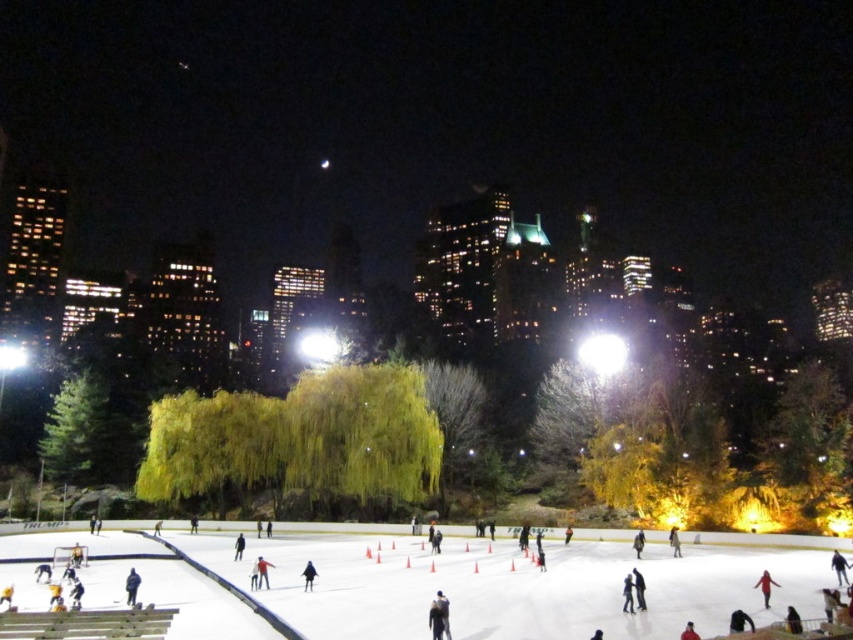
Question: Can you confirm if light blue fabric jacket at center is wider than dark brown leather jacket at center?

Choices:
 (A) no
 (B) yes

Answer: (A)

Question: Can you confirm if red fabric coat at center is positioned below blue fabric jacket at center?

Choices:
 (A) yes
 (B) no

Answer: (B)

Question: Does white fabric jacket at center have a lesser width compared to light brown leather jacket at center?

Choices:
 (A) no
 (B) yes

Answer: (B)

Question: Which object is the closest to the red fabric coat at center?

Choices:
 (A) light blue fabric jacket at center
 (B) white fabric jacket at center
 (C) dark blue fabric at center

Answer: (A)

Question: Which of the following is the closest to the observer?

Choices:
 (A) (675, 532)
 (B) (683, 632)
 (C) (265, 570)

Answer: (B)

Question: Which of the following is the closest to the observer?

Choices:
 (A) (241, 547)
 (B) (675, 544)
 (C) (636, 540)
 (D) (683, 630)

Answer: (D)